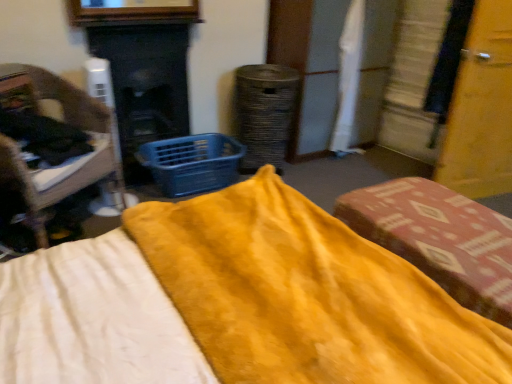
Question: From a real-world perspective, is smooth black fireplace at center-left on blue plastic basket at center?

Choices:
 (A) no
 (B) yes

Answer: (B)

Question: From the image's perspective, would you say smooth black fireplace at center-left is positioned over blue plastic basket at center?

Choices:
 (A) yes
 (B) no

Answer: (A)

Question: Is smooth black fireplace at center-left taller than blue plastic basket at center?

Choices:
 (A) yes
 (B) no

Answer: (A)

Question: Could you tell me if smooth black fireplace at center-left is facing blue plastic basket at center?

Choices:
 (A) yes
 (B) no

Answer: (A)

Question: Are smooth black fireplace at center-left and blue plastic basket at center making contact?

Choices:
 (A) yes
 (B) no

Answer: (B)

Question: Is wooden chair at left, the second furniture viewed from the right, bigger or smaller than blue plastic basket at center?

Choices:
 (A) small
 (B) big

Answer: (B)

Question: From the image's perspective, is wooden chair at left, the second furniture viewed from the right, above or below blue plastic basket at center?

Choices:
 (A) below
 (B) above

Answer: (B)

Question: Is wooden chair at left, placed as the 1th furniture when sorted from left to right, in front of or behind blue plastic basket at center in the image?

Choices:
 (A) behind
 (B) front

Answer: (B)

Question: Is wooden chair at left, placed as the 1th furniture when sorted from left to right, to the left or to the right of blue plastic basket at center in the image?

Choices:
 (A) left
 (B) right

Answer: (A)

Question: Is yellow soft fabric bed at center wider or thinner than smooth black fireplace at center-left?

Choices:
 (A) wide
 (B) thin

Answer: (A)

Question: Is point (234, 354) closer or farther from the camera than point (181, 59)?

Choices:
 (A) farther
 (B) closer

Answer: (B)

Question: Is yellow soft fabric bed at center in front of or behind smooth black fireplace at center-left in the image?

Choices:
 (A) behind
 (B) front

Answer: (B)

Question: From the image's perspective, is yellow soft fabric bed at center located above or below smooth black fireplace at center-left?

Choices:
 (A) above
 (B) below

Answer: (B)

Question: Based on their sizes in the image, would you say smooth black fireplace at center-left is bigger or smaller than wooden chair at left, the second furniture viewed from the right?

Choices:
 (A) small
 (B) big

Answer: (A)

Question: Is smooth black fireplace at center-left wider or thinner than wooden chair at left, the second furniture viewed from the right?

Choices:
 (A) wide
 (B) thin

Answer: (B)